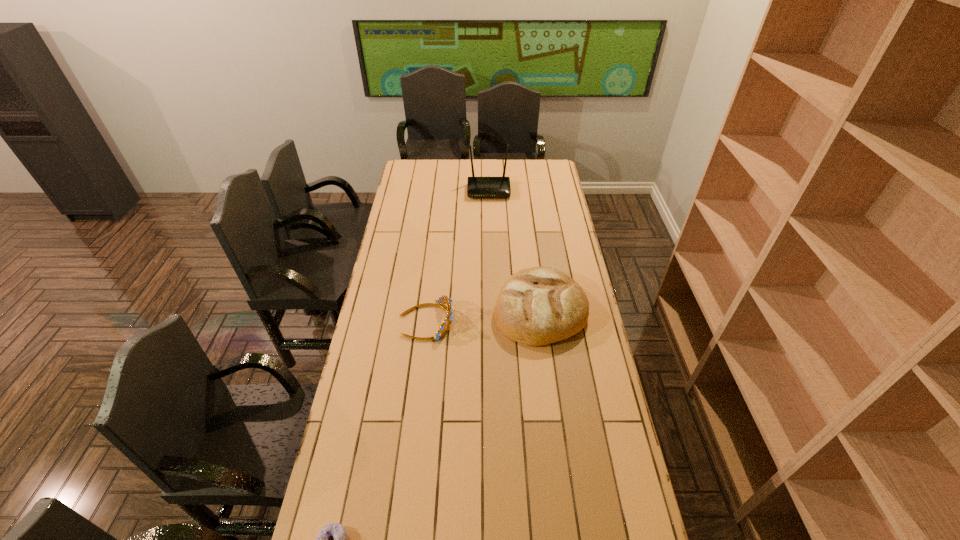
Image resolution: width=960 pixels, height=540 pixels. What are the coordinates of `the farthest object` in the screenshot? It's located at (477, 187).

Image resolution: width=960 pixels, height=540 pixels. In order to click on the tallest object in this screenshot , I will do `click(477, 187)`.

Where is `the third object from right to left`? the third object from right to left is located at coordinates (442, 330).

I want to click on bread, so click(536, 306).

Where is `vacant space located on the front-facing side of the farthest object`? This screenshot has width=960, height=540. vacant space located on the front-facing side of the farthest object is located at coordinates (489, 207).

You are a GUI agent. You are given a task and a screenshot of the screen. Output one action in this format:
    pyautogui.click(x=<x>, y=<y>)
    Task: Click on the free point located 0.250m on the front-facing side of the third object from right to left
    Image resolution: width=960 pixels, height=540 pixels.
    Given the screenshot: What is the action you would take?
    pyautogui.click(x=516, y=321)

You are a GUI agent. You are given a task and a screenshot of the screen. Output one action in this format:
    pyautogui.click(x=<x>, y=<y>)
    Task: Click on the free spot located 0.220m on the back of the bread
    The image size is (960, 540).
    Given the screenshot: What is the action you would take?
    pyautogui.click(x=532, y=244)

This screenshot has width=960, height=540. In order to click on object situated at the left edge in this screenshot , I will do `click(442, 330)`.

I want to click on object that is positioned at the right edge, so click(536, 306).

The height and width of the screenshot is (540, 960). I want to click on vacant space at the far edge of the desktop, so click(x=517, y=176).